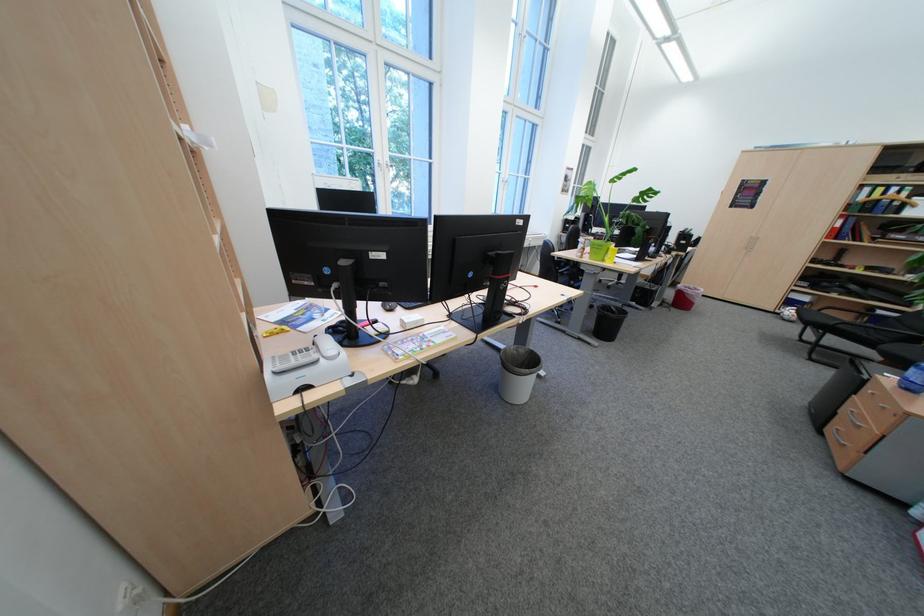
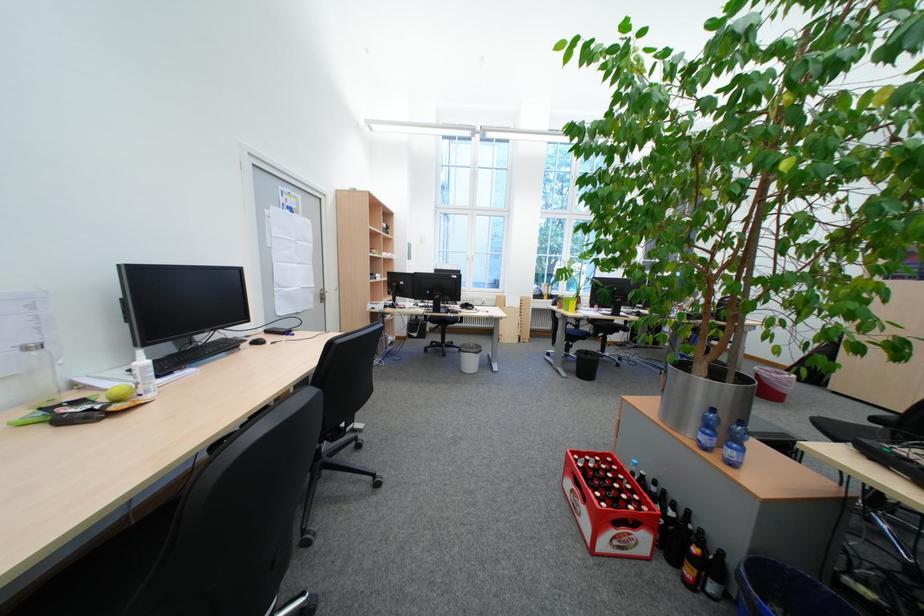
Question: I am providing you with two images of the same scene from different viewpoints. Which of the following objects are not visible in image2?

Choices:
 (A) black computer mouse
 (B) red colored pencil
 (C) white spray bottle
 (D) blue plastic bucket

Answer: (A)